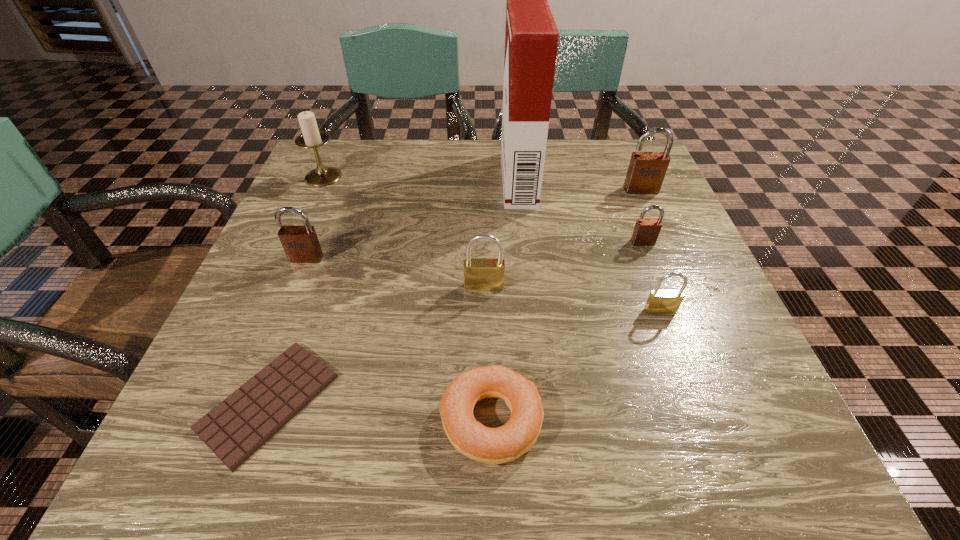
The height and width of the screenshot is (540, 960). What are the coordinates of `free spot between the chocolate bar and the leftmost brown padlock` in the screenshot? It's located at (288, 330).

The height and width of the screenshot is (540, 960). Identify the location of free space between the biggest brown padlock and the smaller brass padlock. (651, 250).

Where is `free spot between the bagel and the red cigarette_case`? The height and width of the screenshot is (540, 960). free spot between the bagel and the red cigarette_case is located at coordinates (505, 300).

Locate an element on the screen. Image resolution: width=960 pixels, height=540 pixels. empty location between the tallest object and the third farthest padlock is located at coordinates (413, 219).

Identify the location of free space between the fourth nearest padlock and the chocolate bar. This screenshot has height=540, width=960. (456, 322).

Locate an element on the screen. The width and height of the screenshot is (960, 540). the fifth closest object to the fourth farthest object is located at coordinates (494, 446).

Where is `object that can be found as the fourth closest to the second farthest brown padlock`? object that can be found as the fourth closest to the second farthest brown padlock is located at coordinates (480, 274).

Select which padlock is the closest to the white candle holder. Please provide its 2D coordinates. Your answer should be formatted as a tuple, i.e. [(x, y)], where the tuple contains the x and y coordinates of a point satisfying the conditions above.

[(301, 245)]

The width and height of the screenshot is (960, 540). What are the coordinates of `padlock that stands as the closest to the farthest brown padlock` in the screenshot? It's located at tap(646, 231).

Locate an element on the screen. the second closest brown padlock to the leftmost brown padlock is located at coordinates point(646,172).